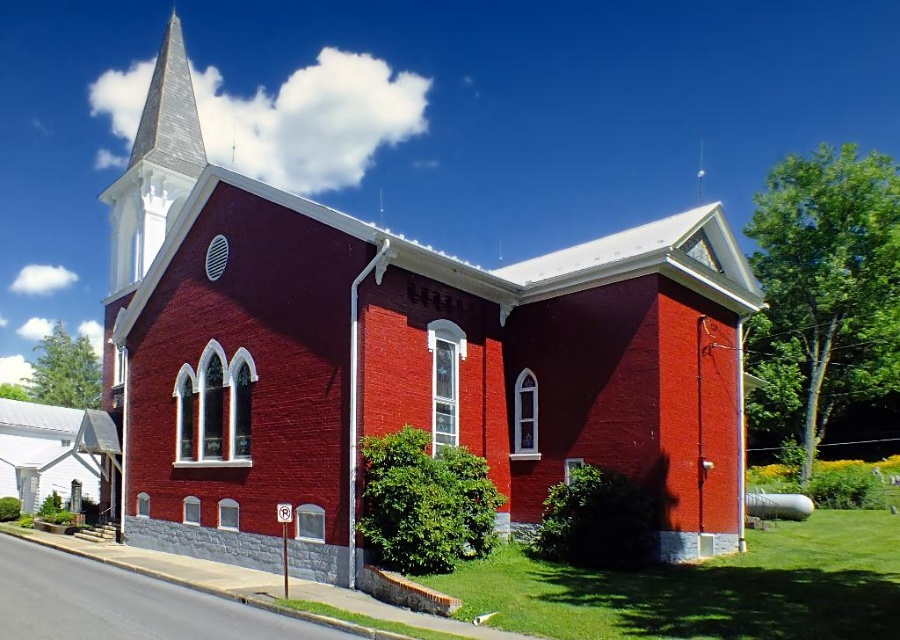
You are standing at the point marked by coordinates point [397,358]. What structure are you directly in front of?

You are directly in front of the brick church at center, as the point [397,358] represents its location.

You are standing at the entrance of the brick church at center and want to look up at the white steeple at upper left. In which direction should you move your gaze?

The brick church at center is below the white steeple at upper left, so you should look upward to see the white steeple at upper left.

You are standing in front of the church and want to take a photo that includes both the brick church at center and the white steeple at upper left. Which object should you focus on first to ensure both are in clear view?

You should focus on the brick church at center first because it is closer to you than the white steeple at upper left, ensuring both are in focus when taking the photo.